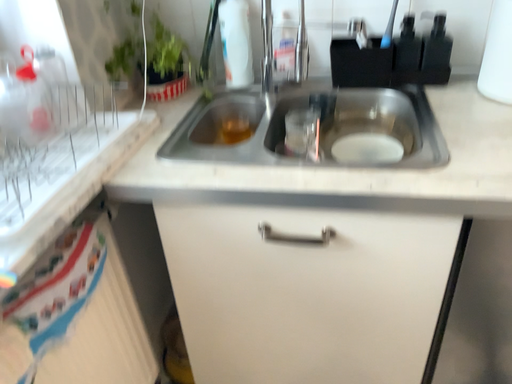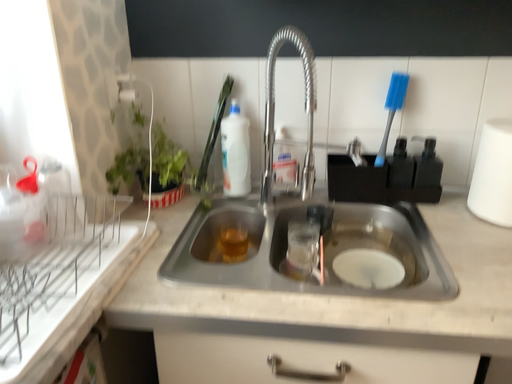
Question: How did the camera likely rotate when shooting the video?

Choices:
 (A) rotated downward
 (B) rotated upward

Answer: (B)